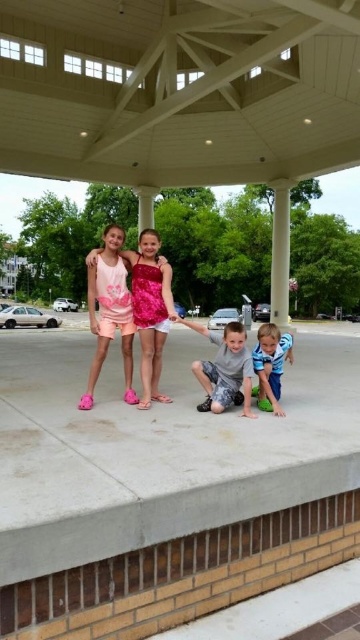
In the scene shown: Does shiny pink dress at center have a smaller size compared to gray camouflage pants at center?

No.

Between shiny pink dress at center and gray camouflage pants at center, which one has more height?

shiny pink dress at center

What do you see at coordinates (131, 266) in the screenshot?
I see `shiny pink dress at center` at bounding box center [131, 266].

In order to click on shiny pink dress at center in this screenshot , I will do `click(131, 266)`.

The width and height of the screenshot is (360, 640). What do you see at coordinates (225, 369) in the screenshot?
I see `gray camouflage pants at center` at bounding box center [225, 369].

Measure the distance from gray camouflage pants at center to blue cotton shirt at lower right.

They are 16.41 inches apart.

Does point (227, 344) come behind point (261, 384)?

No, (227, 344) is in front of (261, 384).

Locate an element on the screen. The image size is (360, 640). gray camouflage pants at center is located at coordinates (225, 369).

Does white smooth column at center lie in front of blue cotton shirt at lower right?

No, it is not.

Is white smooth column at center thinner than blue cotton shirt at lower right?

No, white smooth column at center is not thinner than blue cotton shirt at lower right.

Between point (284, 204) and point (281, 346), which one is positioned behind?

The point (284, 204) is behind.

This screenshot has width=360, height=640. In order to click on white smooth column at center in this screenshot , I will do `click(280, 253)`.